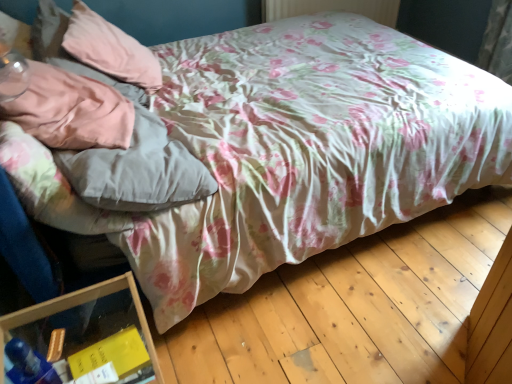
Question: Is pink fabric pillow at upper left, marked as the second pillow in a front-to-back arrangement, wider than transparent plastic container at lower left?

Choices:
 (A) yes
 (B) no

Answer: (A)

Question: Is pink fabric pillow at upper left, marked as the second pillow in a front-to-back arrangement, at the left side of transparent plastic container at lower left?

Choices:
 (A) yes
 (B) no

Answer: (A)

Question: Does pink fabric pillow at upper left, marked as the second pillow in a front-to-back arrangement, have a larger size compared to transparent plastic container at lower left?

Choices:
 (A) no
 (B) yes

Answer: (A)

Question: Can transparent plastic container at lower left be found inside pink fabric pillow at upper left, the 1th pillow from the back?

Choices:
 (A) no
 (B) yes

Answer: (A)

Question: From the image's perspective, is pink fabric pillow at upper left, marked as the second pillow in a front-to-back arrangement, located above transparent plastic container at lower left?

Choices:
 (A) no
 (B) yes

Answer: (B)

Question: Is satin pink pillow at upper left, which is the second pillow in back-to-front order, taller or shorter than pink fabric pillow at upper left, marked as the second pillow in a front-to-back arrangement?

Choices:
 (A) short
 (B) tall

Answer: (A)

Question: From a real-world perspective, is satin pink pillow at upper left, which is the first pillow from front to back, positioned above or below pink fabric pillow at upper left, the 1th pillow from the back?

Choices:
 (A) above
 (B) below

Answer: (A)

Question: Is satin pink pillow at upper left, which is the first pillow from front to back, wider or thinner than pink fabric pillow at upper left, marked as the second pillow in a front-to-back arrangement?

Choices:
 (A) wide
 (B) thin

Answer: (B)

Question: Is satin pink pillow at upper left, which is the first pillow from front to back, spatially inside pink fabric pillow at upper left, the 1th pillow from the back, or outside of it?

Choices:
 (A) outside
 (B) inside

Answer: (A)

Question: From a real-world perspective, is transparent plastic container at lower left above or below satin pink pillow at upper left, which is the second pillow in back-to-front order?

Choices:
 (A) above
 (B) below

Answer: (B)

Question: From the image's perspective, is transparent plastic container at lower left above or below satin pink pillow at upper left, which is the second pillow in back-to-front order?

Choices:
 (A) below
 (B) above

Answer: (A)

Question: Looking at the image, does transparent plastic container at lower left seem bigger or smaller compared to satin pink pillow at upper left, which is the first pillow from front to back?

Choices:
 (A) big
 (B) small

Answer: (A)

Question: Considering the positions of point (96, 296) and point (22, 125), is point (96, 296) closer or farther from the camera than point (22, 125)?

Choices:
 (A) closer
 (B) farther

Answer: (A)

Question: From the image's perspective, is pink fabric pillow at upper left, the 1th pillow from the back, positioned above or below transparent plastic container at lower left?

Choices:
 (A) below
 (B) above

Answer: (B)

Question: Relative to transparent plastic container at lower left, is pink fabric pillow at upper left, the 1th pillow from the back, in front or behind?

Choices:
 (A) behind
 (B) front

Answer: (A)